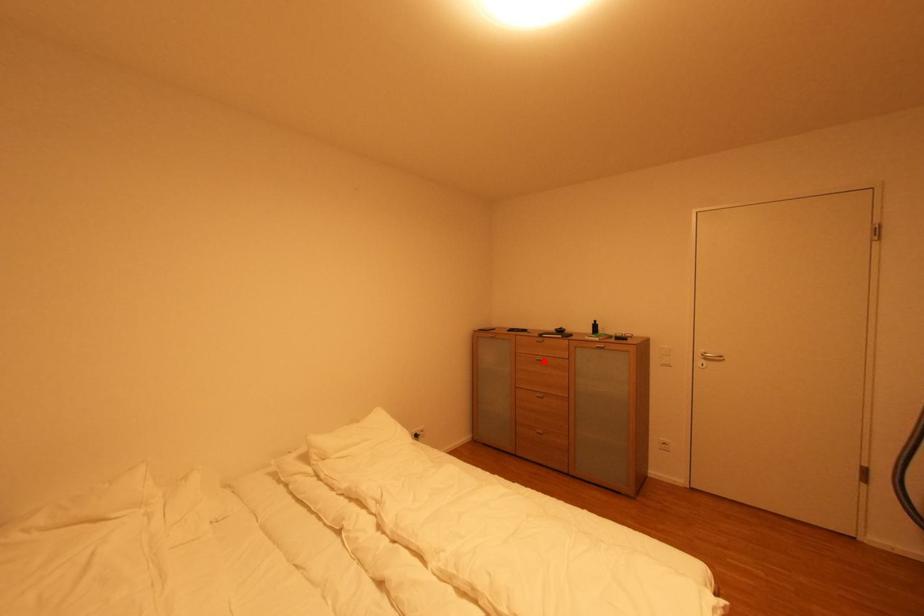
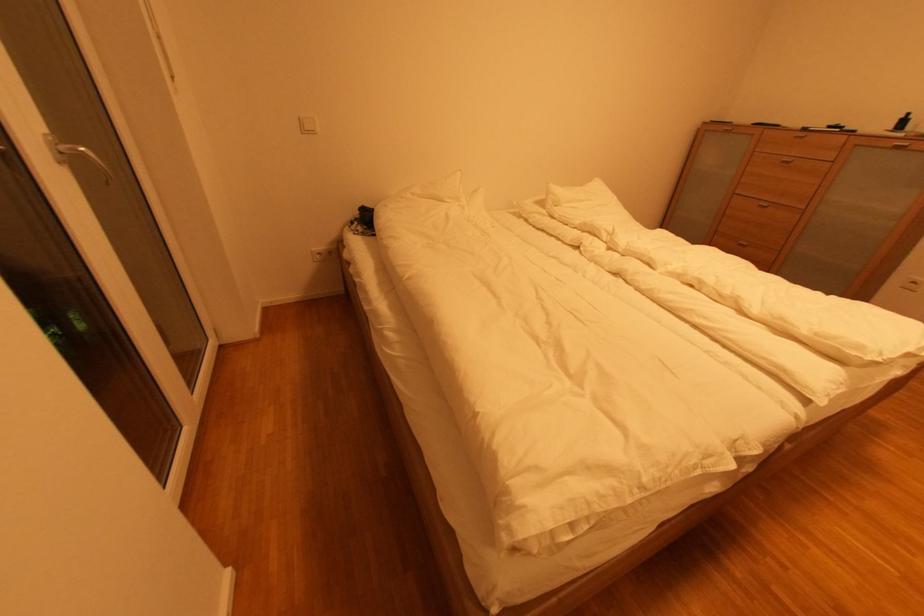
Question: I am providing you with two images of the same scene from different viewpoints. Given a red point in image1, look at the same physical point in image2. Is it:

Choices:
 (A) Closer to the viewpoint
 (B) Farther from the viewpoint

Answer: (B)